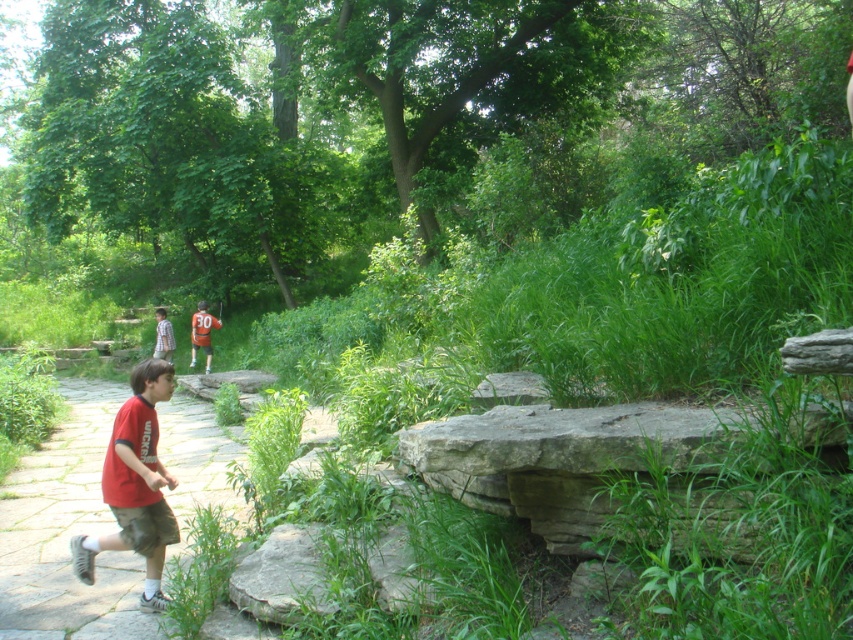
You are a photographer standing at the end of the stone pathway. You want to take a photo of both the red fabric shirt at center and the plaid shirt at center. Based on their positions, which child should you focus on first to ensure both are in the frame?

Answer: The red fabric shirt at center is in front of the plaid shirt at center, so you should focus on the red fabric shirt at center first to ensure both are in the frame.